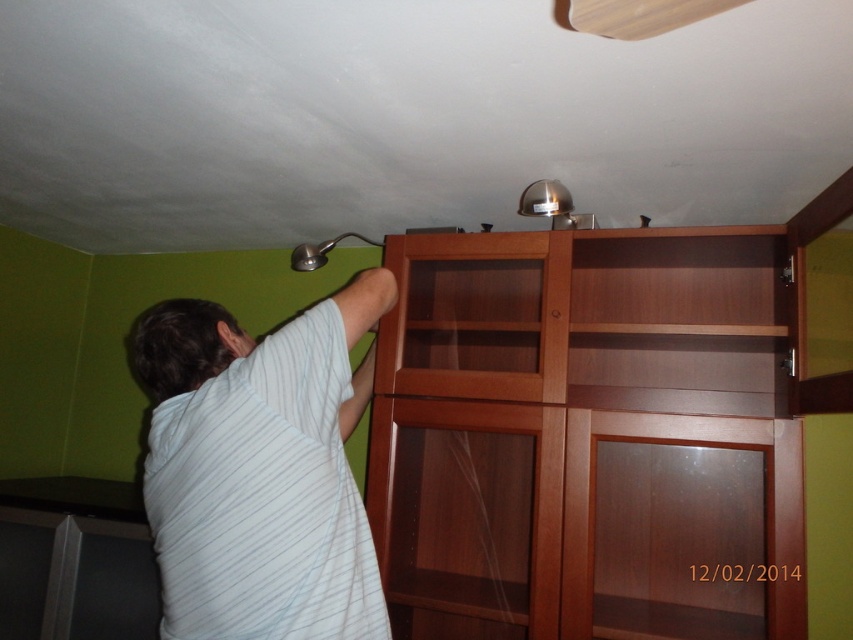
You are a maintenance worker needing to access the wooden cabinet at right. Given that the cabinet is at coordinates approximately 0.686 on the x and 0.688 on the y axis, can you estimate its position relative to the room?

The wooden cabinet at right is located at point (x=585, y=438), meaning it is positioned towards the upper right corner of the room.

You are a painter who needs to paint the ceiling. You are standing in the room and see the wooden cabinet at right and white striped shirt at upper left. Can you reach the ceiling with your 6 feet tall ladder? Please explain.

The wooden cabinet at right and white striped shirt at upper left are 23.97 inches apart. Since the ladder is 6 feet tall, which is 72 inches, and the distance between the objects is only 23.97 inches, the ladder is more than sufficient to reach the ceiling. However, the exact height needed isn mentioned, so the distance between the objects doesn provide enough information to determine if the ladder is tall enough. Therefore, it is unclear if the 6 feet ladder can reach the ceiling based on the provided gap

From the picture: You are a painter who needs to reach a paintbrush hanging from the white striped shirt at upper left. The wooden cabinet at right is in your way. Can you move the cabinet to access the paintbrush?

The wooden cabinet at right is positioned under the white striped shirt at upper left, so you cannot move the cabinet to access the paintbrush because it is already located beneath the shirt where the paintbrush is hanging.